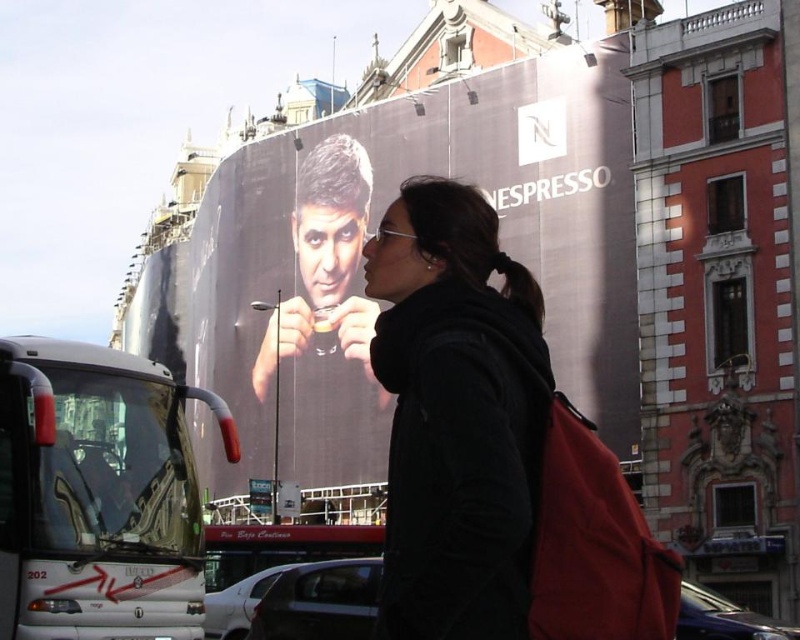
Is matte black billboard at center above white glossy bus at lower left?

Correct, matte black billboard at center is located above white glossy bus at lower left.

Where is `matte black billboard at center`? This screenshot has width=800, height=640. matte black billboard at center is located at coordinates (360, 268).

Between point (186, 256) and point (154, 387), which one is positioned in front?

Positioned in front is point (154, 387).

The width and height of the screenshot is (800, 640). I want to click on matte black billboard at center, so click(x=360, y=268).

Does matte black billboard at center appear over black matte jacket at center?

Yes, matte black billboard at center is above black matte jacket at center.

Which is below, matte black billboard at center or black matte jacket at center?

Positioned lower is black matte jacket at center.

Measure the distance between point (454, 161) and camera.

A distance of 224.19 feet exists between point (454, 161) and camera.

This screenshot has height=640, width=800. Identify the location of matte black billboard at center. (360, 268).

Who is more forward, (490, 529) or (72, 467)?

Point (490, 529) is in front.

Does black matte jacket at center appear on the right side of white glossy bus at lower left?

Indeed, black matte jacket at center is positioned on the right side of white glossy bus at lower left.

This screenshot has height=640, width=800. Describe the element at coordinates (456, 417) in the screenshot. I see `black matte jacket at center` at that location.

Locate an element on the screen. black matte jacket at center is located at coordinates (456, 417).